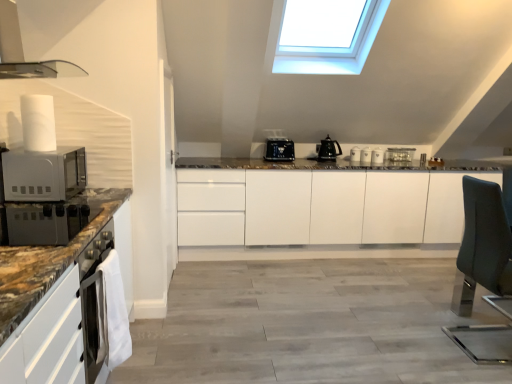
At what (x,y) coordinates should I click in order to perform the action: click on free space to the back side of teal fabric swivel chair at right. Please return your answer as a coordinate pair (x, y). Looking at the image, I should click on (445, 309).